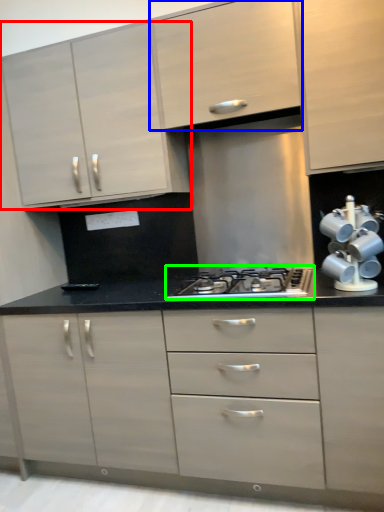
Question: Estimate the real-world distances between objects in this image. Which object is closer to cabinetry (highlighted by a red box), cabinetry (highlighted by a blue box) or gas stove (highlighted by a green box)?

Choices:
 (A) cabinetry
 (B) gas stove

Answer: (A)